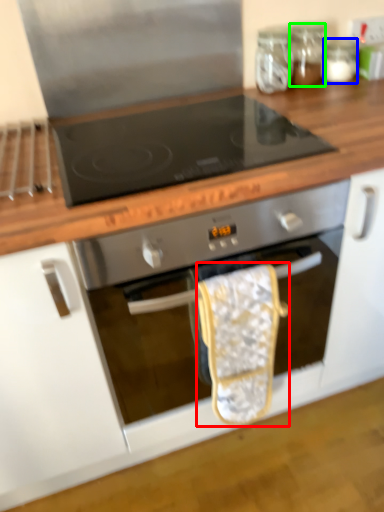
Question: Estimate the real-world distances between objects in this image. Which object is farther from material (highlighted by a red box), glass jar (highlighted by a blue box) or glass jar (highlighted by a green box)?

Choices:
 (A) glass jar
 (B) glass jar

Answer: (A)